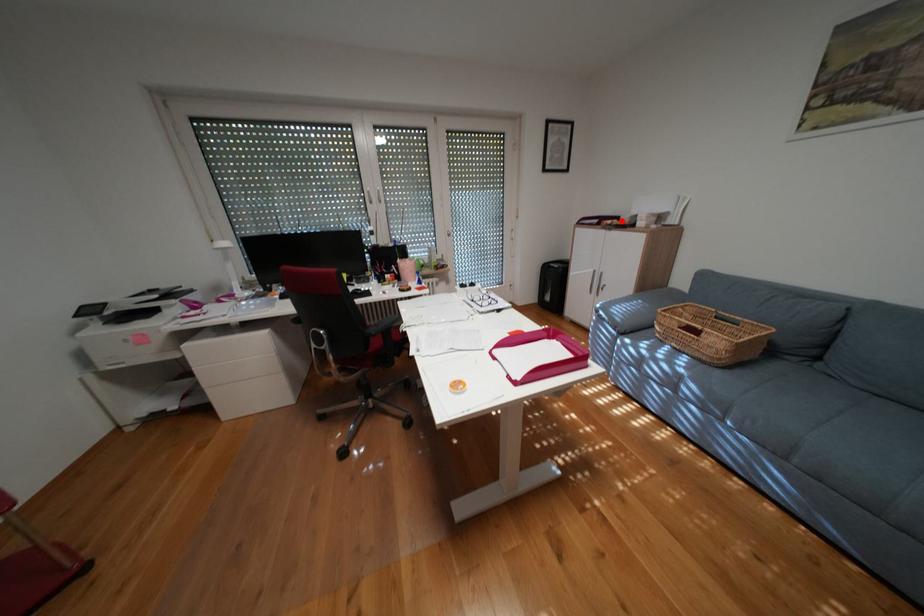
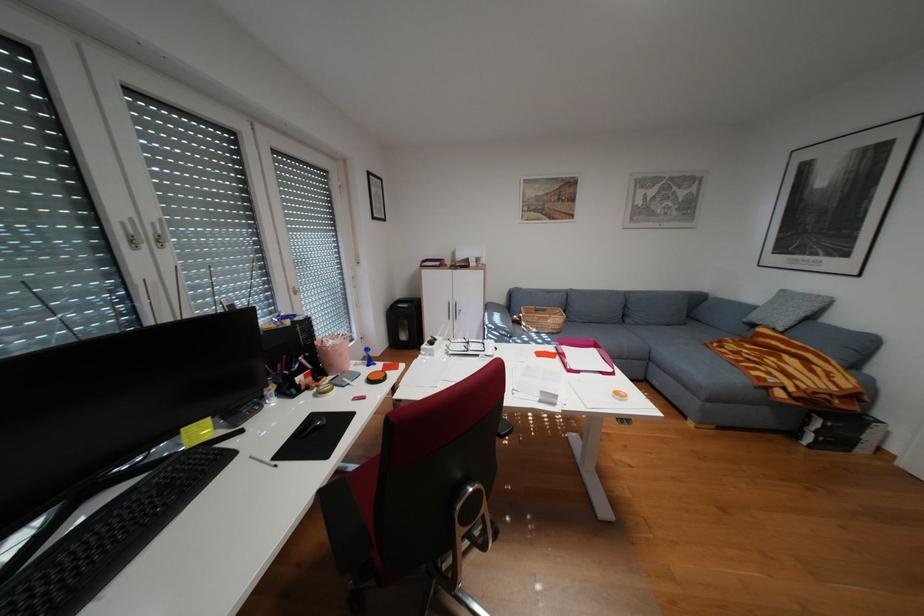
Question: I am providing you with two images of the same scene from different viewpoints. A red point is marked on the first image. Can you still see the location of the red point in image 2?

Choices:
 (A) Yes
 (B) No

Answer: (A)